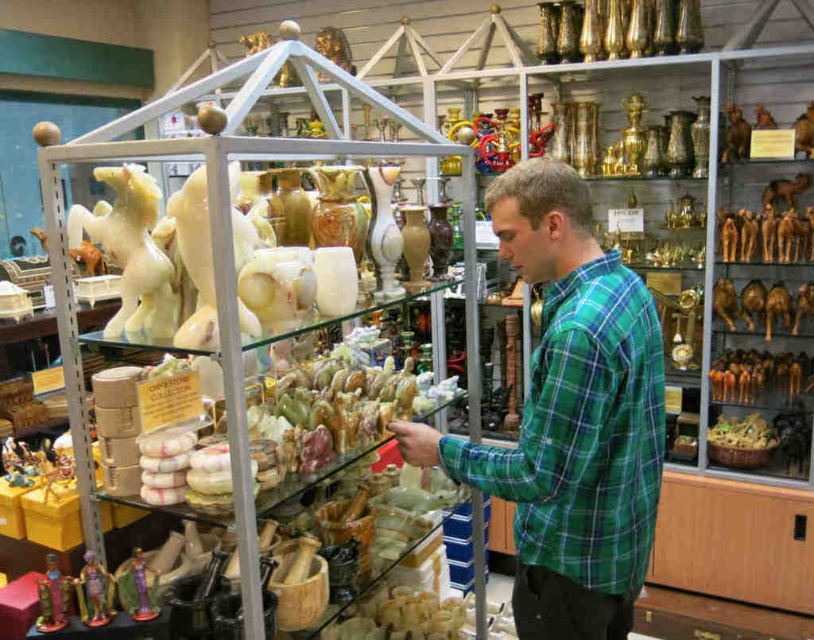
Question: Which object appears closest to the camera in this image?

Choices:
 (A) white glossy horse at center
 (B) shiny gold figurine at lower left

Answer: (B)

Question: Is brown wooden figurine at center-right above metallic gold figurine at lower left?

Choices:
 (A) yes
 (B) no

Answer: (A)

Question: Among these objects, which one is nearest to the camera?

Choices:
 (A) shiny gold figurine at lower left
 (B) brown wooden figurine at center-right
 (C) metallic gold figurine at lower left
 (D) purple glossy figurine at lower left

Answer: (C)

Question: Can you confirm if purple glossy figurine at lower left is positioned to the right of shiny gold figurine at lower left?

Choices:
 (A) yes
 (B) no

Answer: (A)

Question: Which of the following is the closest to the observer?

Choices:
 (A) (130, 189)
 (B) (88, 604)
 (C) (59, 620)
 (D) (760, 371)

Answer: (C)

Question: Is brown wooden figurine at center-right bigger than metallic gold figurine at lower left?

Choices:
 (A) yes
 (B) no

Answer: (A)